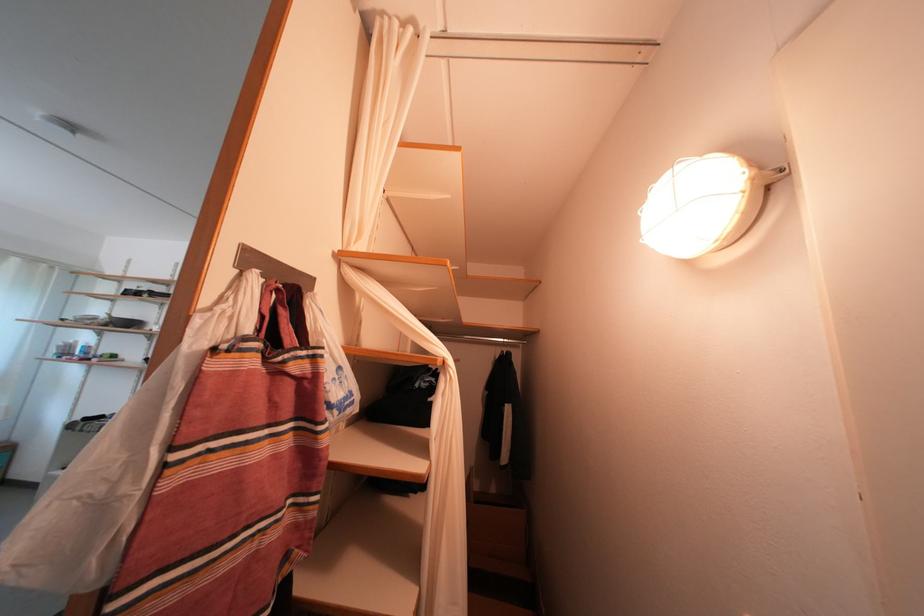
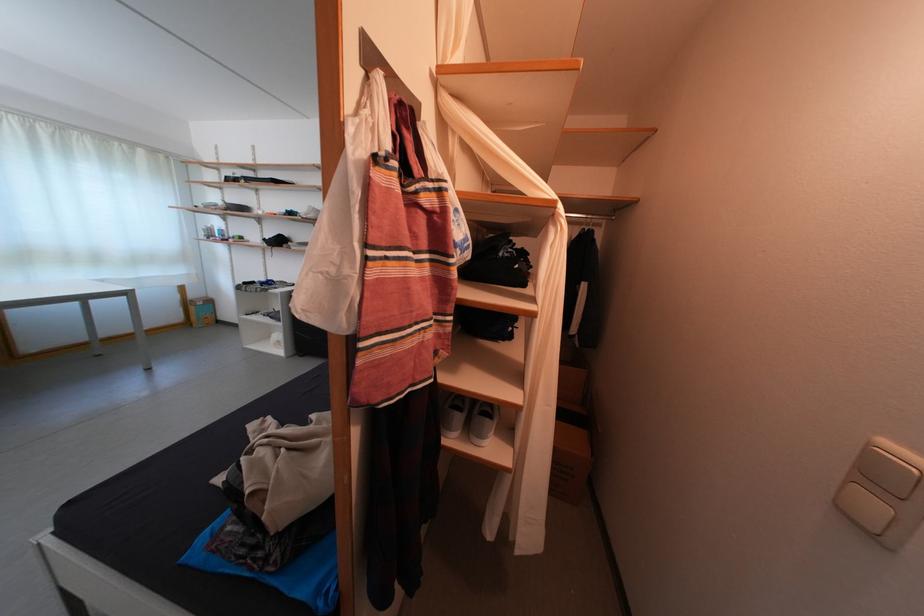
Where in the second image is the point corresponding to point (149, 499) from the first image?

(366, 282)